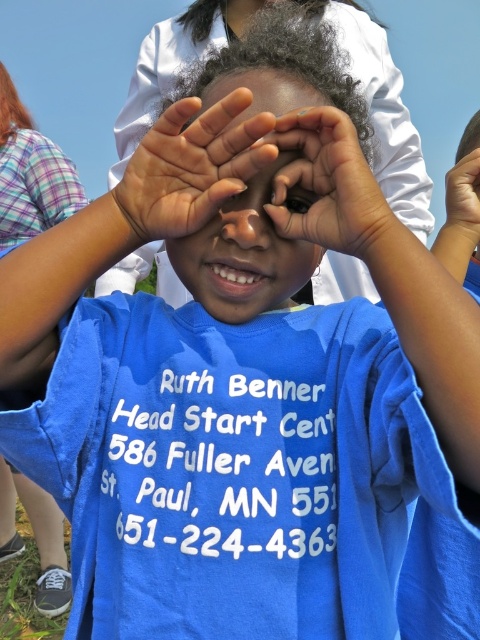
You are a photographer trying to capture a closeup of the child in the image. The point at center is marked as point (191, 166). Where is this point located on the child?

The point at (191, 166) is located on the palm skin at center.

You are a photographer capturing this image. The matte skin hand at center is part of the subject you want to focus on. Given that the camera needs to be at least 24 inches away to avoid distortion, is the current distance sufficient?

The matte skin hand at center is only 23.31 inches away from the camera, which is less than the required 24 inches. Moving the camera back slightly would help achieve the desired focus without distortion.